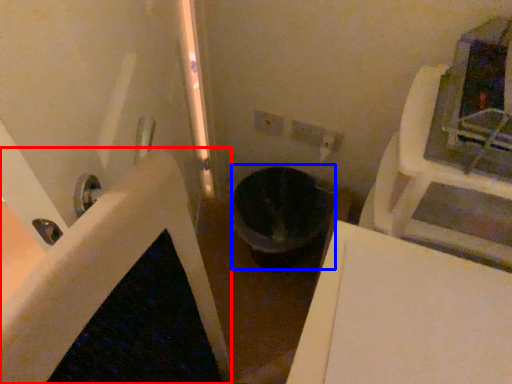
Question: Which object is closer to the camera taking this photo, bath (highlighted by a red box) or toilet bowl (highlighted by a blue box)?

Choices:
 (A) bath
 (B) toilet bowl

Answer: (A)